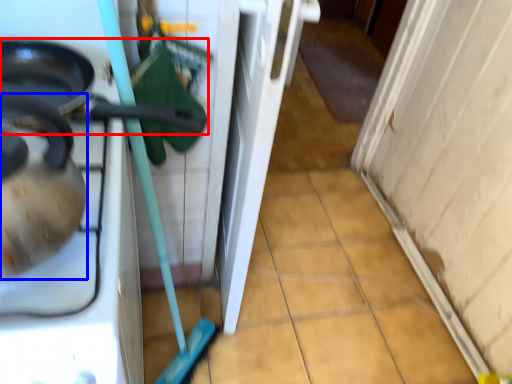
Question: Which object appears farthest to the camera in this image, frying pan (highlighted by a red box) or tea pot (highlighted by a blue box)?

Choices:
 (A) frying pan
 (B) tea pot

Answer: (A)